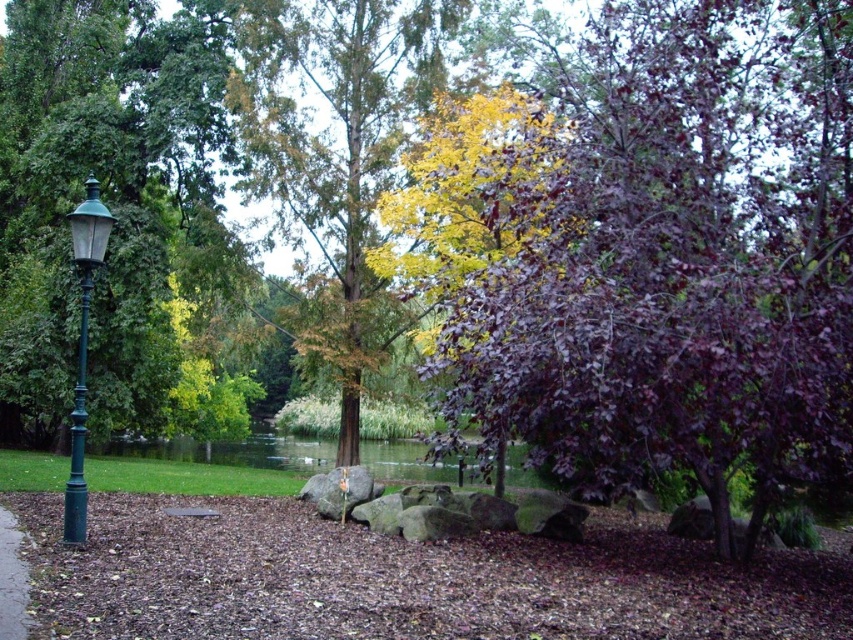
What is the spatial relationship between the purple glossy tree at center and the green polished metal pole at left in the park scene?

The purple glossy tree at center is positioned to the right of the green polished metal pole at left.